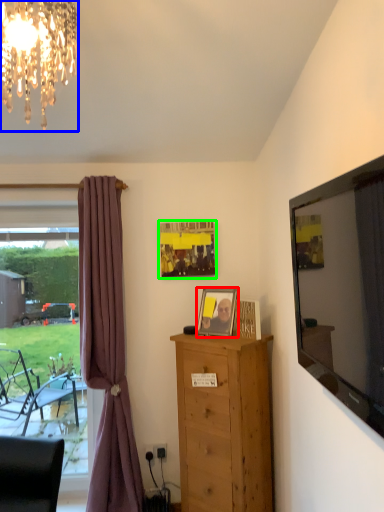
Question: Estimate the real-world distances between objects in this image. Which object is closer to picture frame (highlighted by a red box), lamp (highlighted by a blue box) or picture frame (highlighted by a green box)?

Choices:
 (A) lamp
 (B) picture frame

Answer: (B)